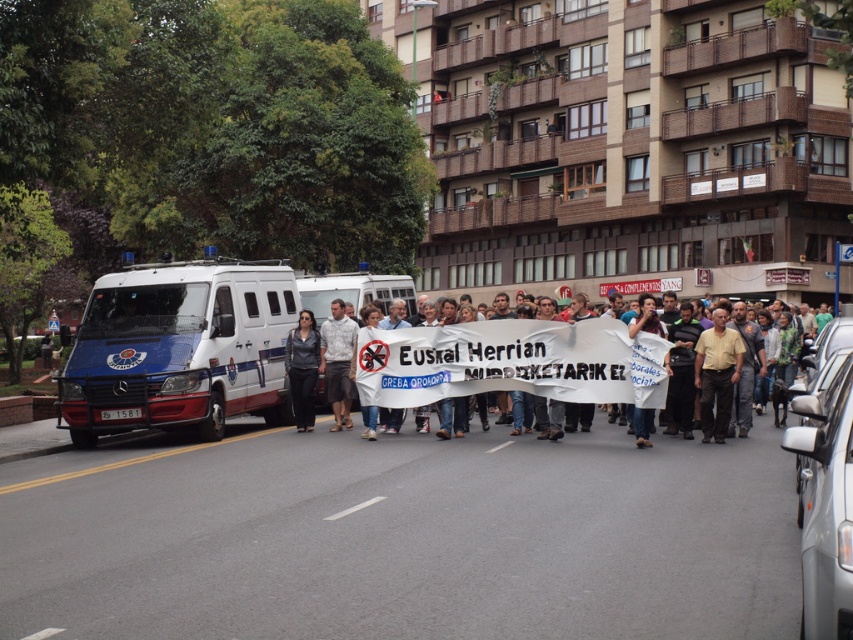
Consider the image. Between yellow cotton shirt at center and dark gray fabric shirt at center, which one appears on the right side from the viewer's perspective?

Positioned to the right is yellow cotton shirt at center.

Who is more forward, (695, 360) or (288, 387)?

Point (695, 360)

Is point (709, 420) closer to camera compared to point (299, 388)?

Yes, point (709, 420) is in front of point (299, 388).

This screenshot has width=853, height=640. Find the location of `yellow cotton shirt at center`. yellow cotton shirt at center is located at coordinates (717, 372).

Which is below, white glossy van at center-left or dark gray fabric shirt at center?

dark gray fabric shirt at center is below.

Is point (178, 330) farther from camera compared to point (287, 365)?

No, (178, 330) is closer to viewer.

Where is `white glossy van at center-left`? white glossy van at center-left is located at coordinates (178, 348).

Does point (338, 305) come behind point (292, 333)?

No, it is not.

Is the position of white printed shirt at center less distant than that of dark gray fabric shirt at center?

Yes.

Which is in front, point (341, 412) or point (312, 417)?

Point (341, 412) is more forward.

The width and height of the screenshot is (853, 640). Identify the location of white printed shirt at center. tap(337, 362).